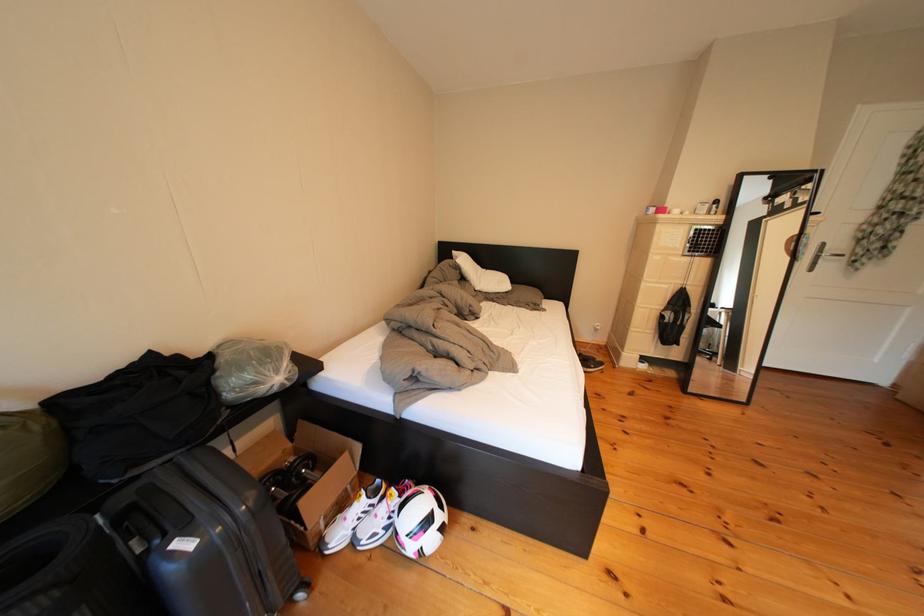
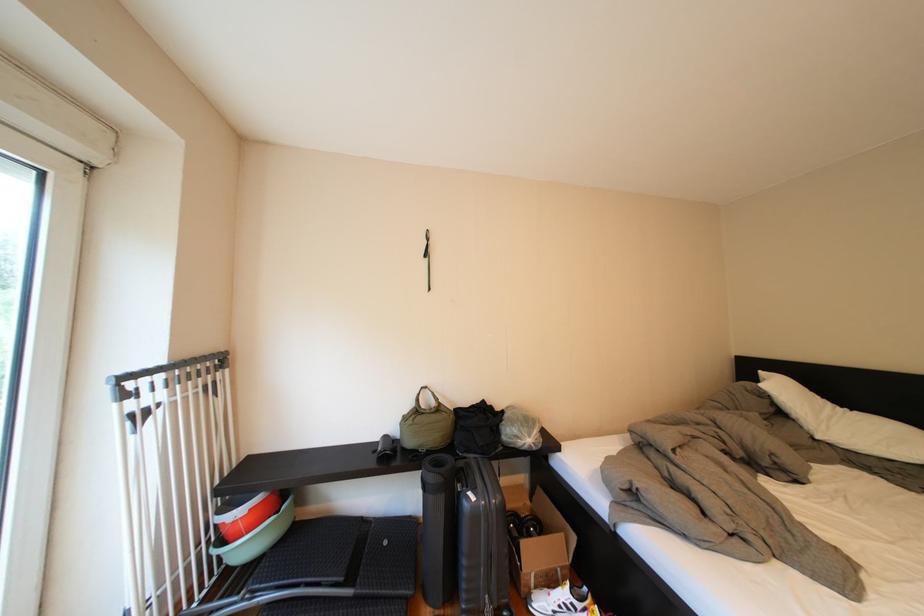
The point at (x=478, y=284) is marked in the first image. Where is the corresponding point in the second image?

(795, 419)